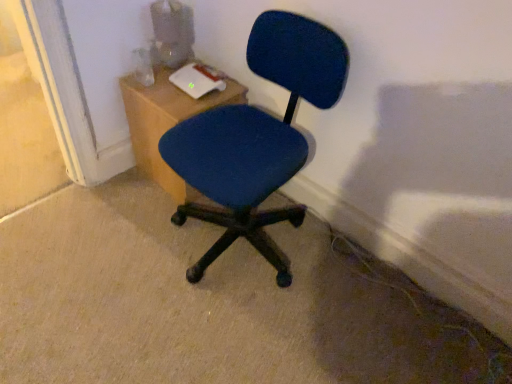
At what (x,y) coordinates should I click in order to perform the action: click on vacant area that is in front of wooden table at upper left. Please return your answer as a coordinate pair (x, y). The height and width of the screenshot is (384, 512). Looking at the image, I should click on (157, 219).